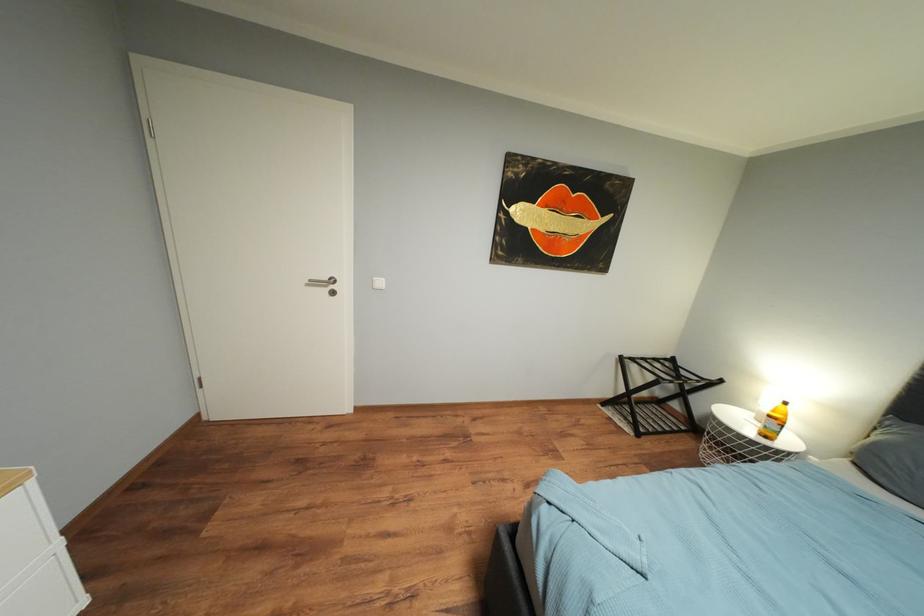
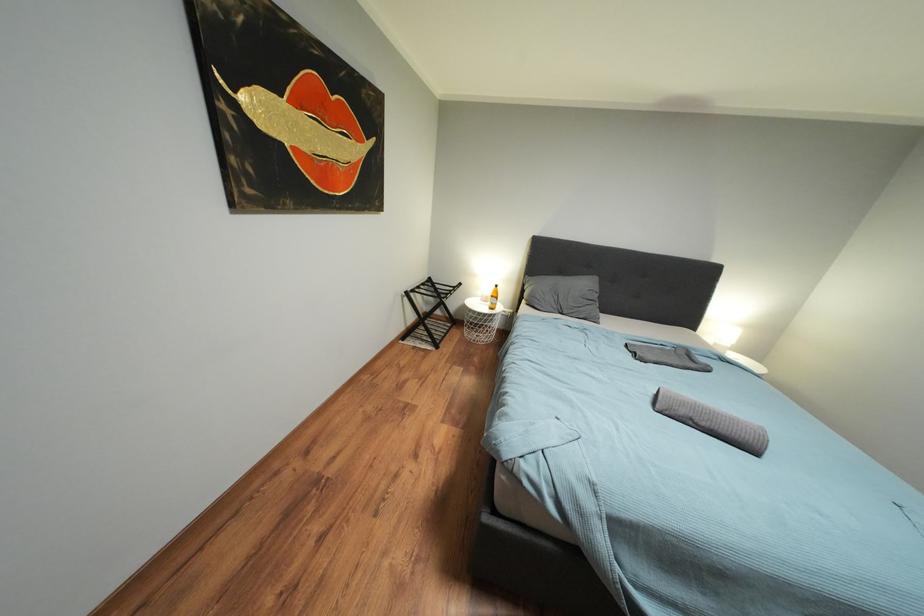
First-person continuous shooting, in which direction is the camera rotating?

The camera rotated toward right-down.